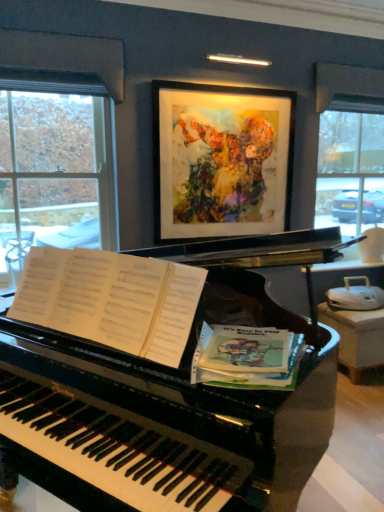
Question: From a real-world perspective, is glossy black piano at center above or below clear glass window at left?

Choices:
 (A) above
 (B) below

Answer: (B)

Question: Relative to clear glass window at left, is glossy black piano at center in front or behind?

Choices:
 (A) front
 (B) behind

Answer: (A)

Question: Which is nearer to the glossy black piano at center?

Choices:
 (A) clear glass window at left
 (B) green paper at piano right
 (C) watercolor painting at upper center

Answer: (B)

Question: Which object is positioned farthest from the green paper at piano right?

Choices:
 (A) watercolor painting at upper center
 (B) glossy black piano at center
 (C) clear glass window at left

Answer: (C)